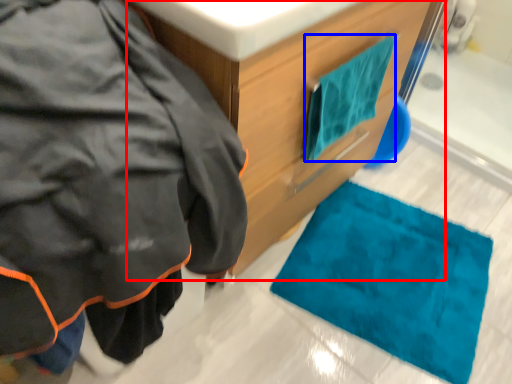
Question: Which object is further to the camera taking this photo, bathroom cabinet (highlighted by a red box) or towel/napkin (highlighted by a blue box)?

Choices:
 (A) bathroom cabinet
 (B) towel/napkin

Answer: (B)